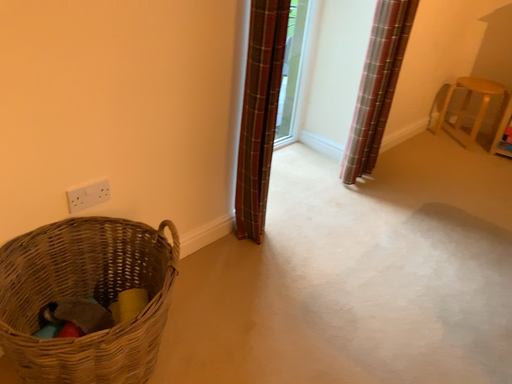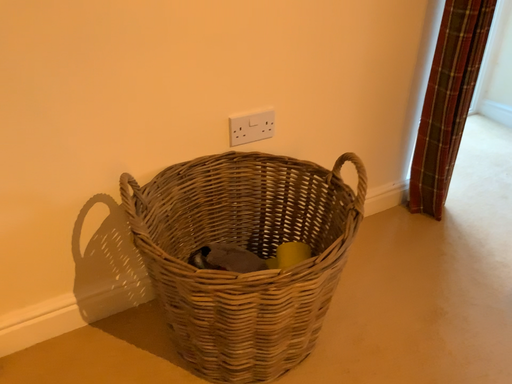
Question: Which way did the camera rotate in the video?

Choices:
 (A) rotated left
 (B) rotated right

Answer: (A)